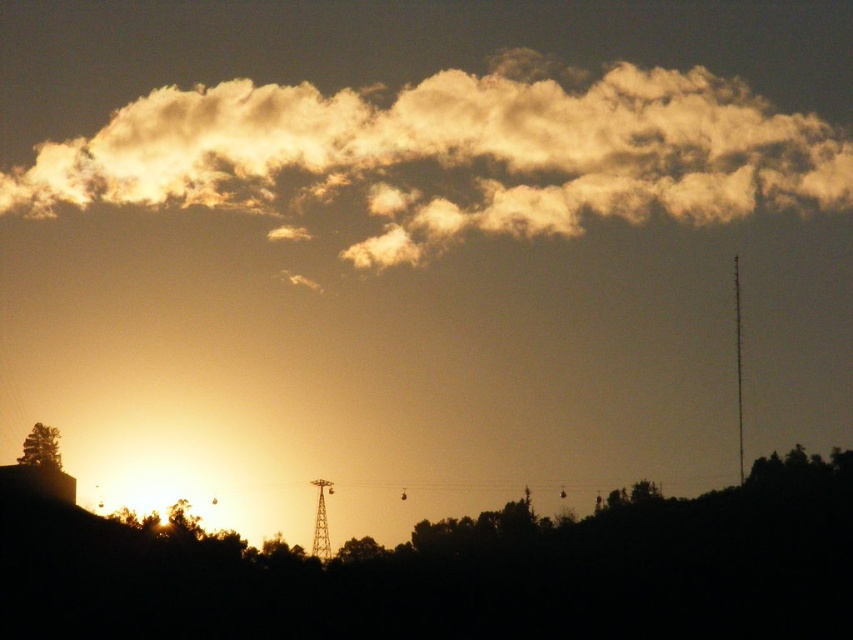
You are an observer standing in the middle of the forest looking towards the sunset. You see the green leafy tree at lower left and the green matte tree at center. Which tree is closer to you?

The green leafy tree at lower left is closer to you because it is located above the green matte tree at center, indicating it is in a higher position relative to your viewpoint.

You are an artist trying to paint this sunset scene. You want to ensure the golden fluffy cloud at upper center and the green leafy tree at lower left are proportionally accurate. Which object should you make wider in your painting?

The golden fluffy cloud at upper center should be made wider in the painting since its width surpasses that of the green leafy tree at lower left.

You are an artist trying to paint the sunset scene. You want to ensure the golden fluffy cloud at upper center and the green matte tree at center are proportionally accurate. Which object should you make wider in your painting?

The golden fluffy cloud at upper center should be made wider than the green matte tree at center in the painting, as its width is larger according to the description.